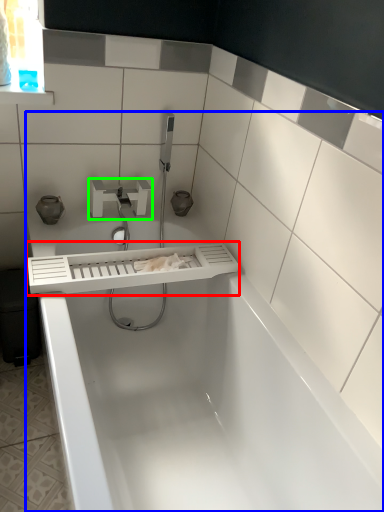
Question: Which object is positioned closest to balustrade (highlighted by a red box)? Select from bathtub (highlighted by a blue box) and tap (highlighted by a green box).

Choices:
 (A) bathtub
 (B) tap

Answer: (A)